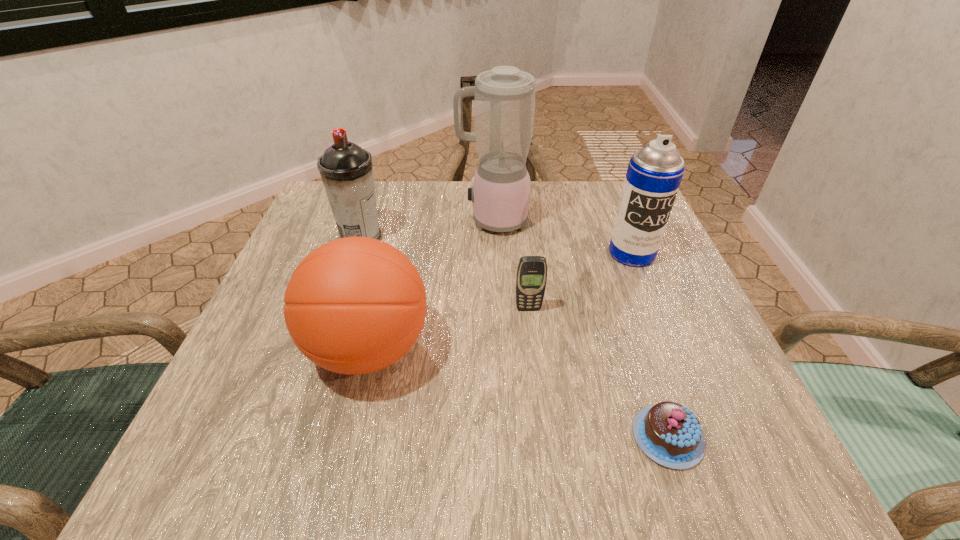
Identify the location of food processor. (504, 98).

I want to click on the right aerosol can, so click(654, 173).

This screenshot has width=960, height=540. In order to click on the left aerosol can in this screenshot , I will do `click(346, 170)`.

This screenshot has width=960, height=540. Find the location of `basketball`. basketball is located at coordinates (355, 305).

This screenshot has width=960, height=540. I want to click on cellular telephone, so click(x=531, y=277).

The image size is (960, 540). Find the location of `chocolate cake`. chocolate cake is located at coordinates (670, 434).

Find the location of a particular element. This screenshot has height=540, width=960. the nearest object is located at coordinates (670, 434).

Find the location of `vacant space located 0.230m on the base of the food processor near the control knob`. vacant space located 0.230m on the base of the food processor near the control knob is located at coordinates click(x=361, y=220).

The image size is (960, 540). I want to click on vacant space located 0.210m on the base of the food processor near the control knob, so click(x=370, y=220).

Image resolution: width=960 pixels, height=540 pixels. I want to click on vacant area situated on the base of the food processor near the control knob, so click(428, 220).